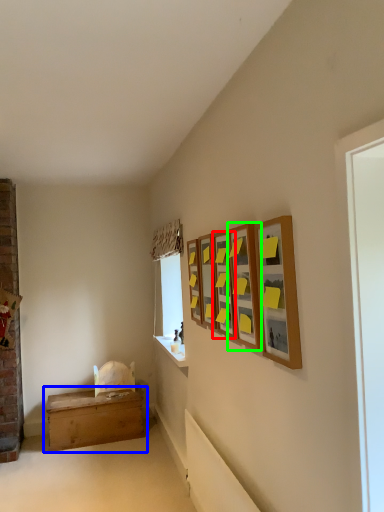
Question: Which object is positioned closest to picture frame (highlighted by a red box)? Select from table (highlighted by a blue box) and picture frame (highlighted by a green box).

Choices:
 (A) table
 (B) picture frame

Answer: (B)